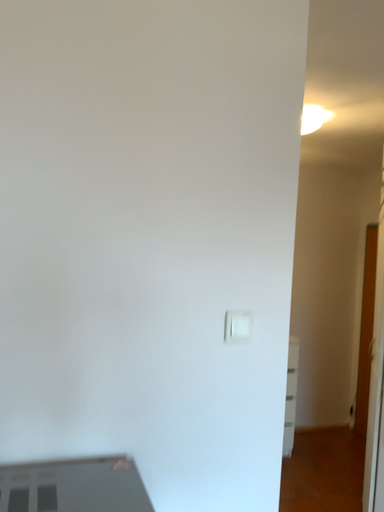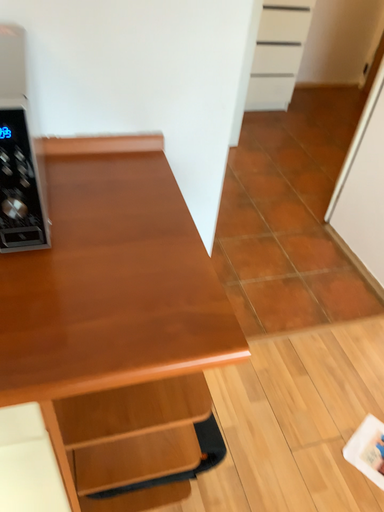
Question: How did the camera likely rotate when shooting the video?

Choices:
 (A) rotated downward
 (B) rotated upward

Answer: (A)